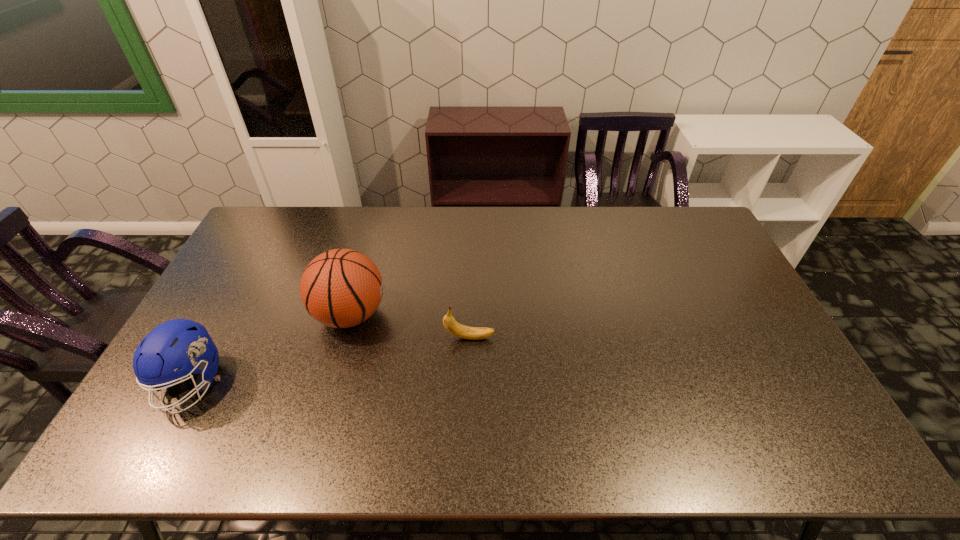
This screenshot has height=540, width=960. In order to click on unoccupied area between the nearest object and the rightmost object in this screenshot , I will do `click(330, 360)`.

Locate an element on the screen. The image size is (960, 540). free point between the second tallest object and the second object from right to left is located at coordinates (271, 349).

You are a GUI agent. You are given a task and a screenshot of the screen. Output one action in this format:
    pyautogui.click(x=<x>, y=<y>)
    Task: Click on the free space between the rightmost object and the second shortest object
    Image resolution: width=960 pixels, height=540 pixels.
    Given the screenshot: What is the action you would take?
    pyautogui.click(x=330, y=360)

What are the coordinates of `empty space between the basketball and the rightmost object` in the screenshot? It's located at (410, 326).

Find the location of a particular element. The height and width of the screenshot is (540, 960). free space between the football helmet and the rightmost object is located at coordinates tap(330, 360).

The width and height of the screenshot is (960, 540). In order to click on vacant space that's between the basketball and the nearest object in this screenshot , I will do `click(271, 349)`.

Find the location of a particular element. free space between the banana and the second object from left to right is located at coordinates (410, 326).

At what (x,y) coordinates should I click in order to perform the action: click on free space between the basketball and the nearest object. Please return your answer as a coordinate pair (x, y). The image size is (960, 540). Looking at the image, I should click on (271, 349).

Select which object appears as the closest to the banana. Please provide its 2D coordinates. Your answer should be formatted as a tuple, i.e. [(x, y)], where the tuple contains the x and y coordinates of a point satisfying the conditions above.

[(340, 288)]

Identify the location of object that is the second closest to the second tallest object. This screenshot has width=960, height=540. (452, 326).